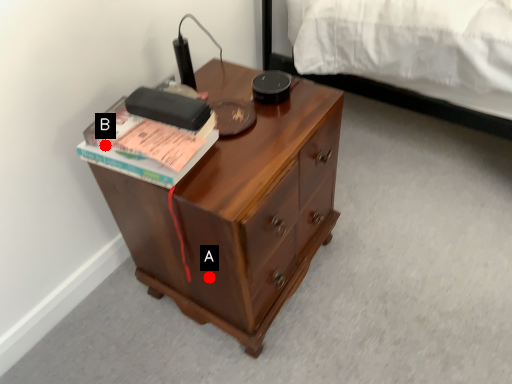
Question: Two points are circled on the image, labeled by A and B beside each circle. Which point is further to the camera?

Choices:
 (A) A is further
 (B) B is further

Answer: (A)